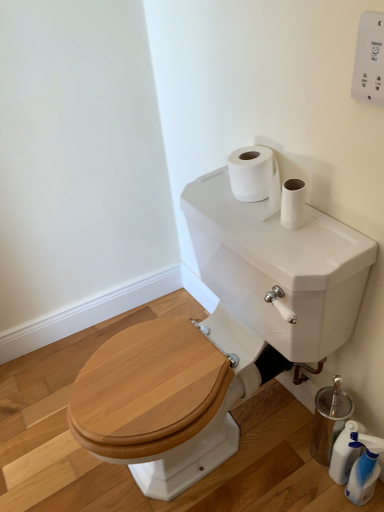
Question: In the image, is translucent plastic spray bottle at lower right, which is the 1th cleaning product in front-to-back order, positioned in front of or behind white plastic remote control at upper right?

Choices:
 (A) behind
 (B) front

Answer: (A)

Question: In terms of size, does translucent plastic spray bottle at lower right, which is the 1th cleaning product in front-to-back order, appear bigger or smaller than white plastic remote control at upper right?

Choices:
 (A) big
 (B) small

Answer: (A)

Question: Which object is the farthest from the white plastic remote control at upper right?

Choices:
 (A) translucent plastic bottle at lower right, which ranks as the 2th cleaning product in front-to-back order
 (B) white glossy tank at upper center
 (C) translucent plastic spray bottle at lower right, the second cleaning product from the back

Answer: (A)

Question: Which object is the farthest from the white glossy tank at upper center?

Choices:
 (A) translucent plastic bottle at lower right, which ranks as the 2th cleaning product in front-to-back order
 (B) white plastic remote control at upper right
 (C) translucent plastic spray bottle at lower right, which is the 1th cleaning product in front-to-back order

Answer: (B)